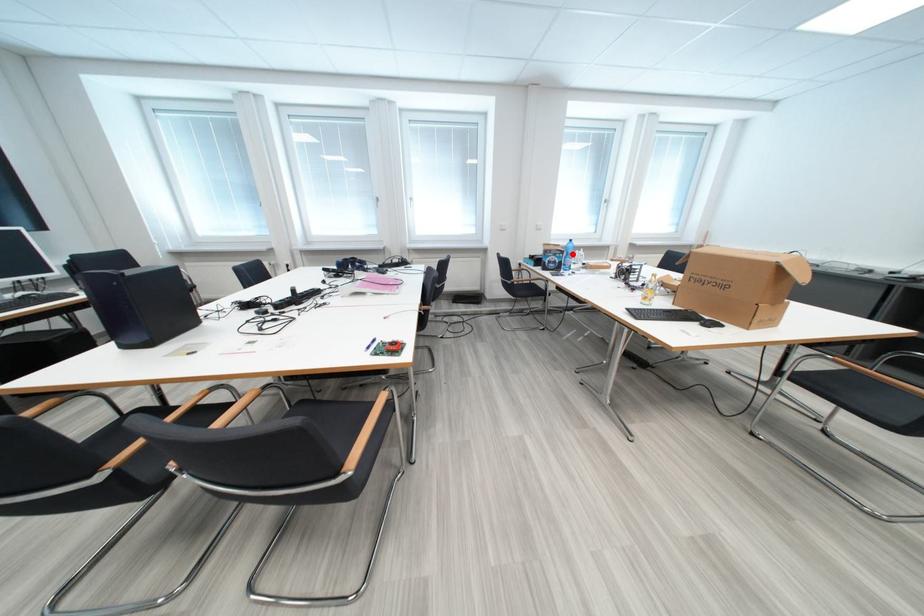
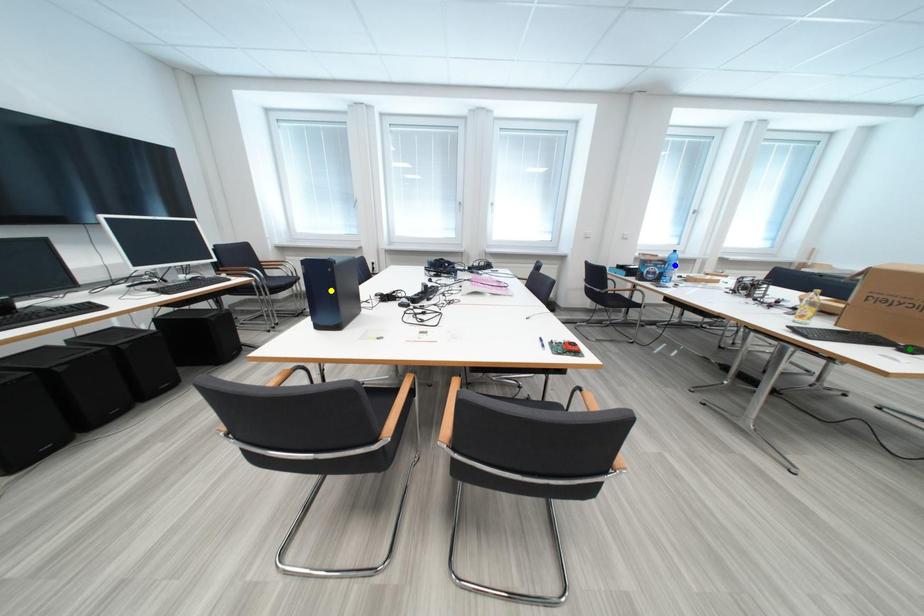
Question: I am providing you with two images of the same scene from different viewpoints. A red point is marked on the first image. You are given multiple points on the second image. Can you choose the point in image 2 that corresponds to the point in image 1?

Choices:
 (A) blue point
 (B) yellow point
 (C) green point

Answer: (A)